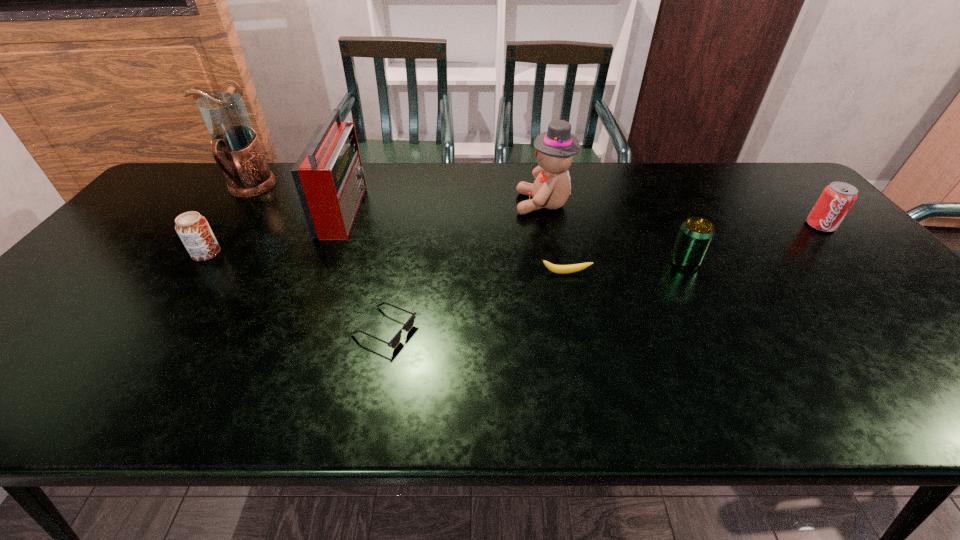
What are the coordinates of `pitcher` in the screenshot? It's located at (235, 146).

Find the location of a particular element. The image size is (960, 540). radio receiver is located at coordinates (328, 175).

Identify the location of rag_doll. (555, 148).

This screenshot has width=960, height=540. Find the location of `soda can`. soda can is located at coordinates (837, 198).

You are a GUI agent. You are given a task and a screenshot of the screen. Output one action in this format:
    pyautogui.click(x=<x>, y=<y>)
    Task: Click on the left beer can
    This screenshot has height=540, width=960.
    Given the screenshot: What is the action you would take?
    pyautogui.click(x=193, y=229)

Where is `the seventh object from left to right`? Image resolution: width=960 pixels, height=540 pixels. the seventh object from left to right is located at coordinates (695, 235).

Locate an element on the screen. The width and height of the screenshot is (960, 540). banana is located at coordinates [x=560, y=269].

Locate an element on the screen. This screenshot has width=960, height=540. the fourth object from left to right is located at coordinates (408, 325).

Locate an element on the screen. the shortest object is located at coordinates (408, 325).

You are a GUI agent. You are given a task and a screenshot of the screen. Output one action in this format:
    pyautogui.click(x=<x>, y=<y>)
    Task: Click on the free point located 0.120m with the handle on the side of the pitcher
    This screenshot has width=960, height=540.
    Given the screenshot: What is the action you would take?
    pyautogui.click(x=220, y=230)